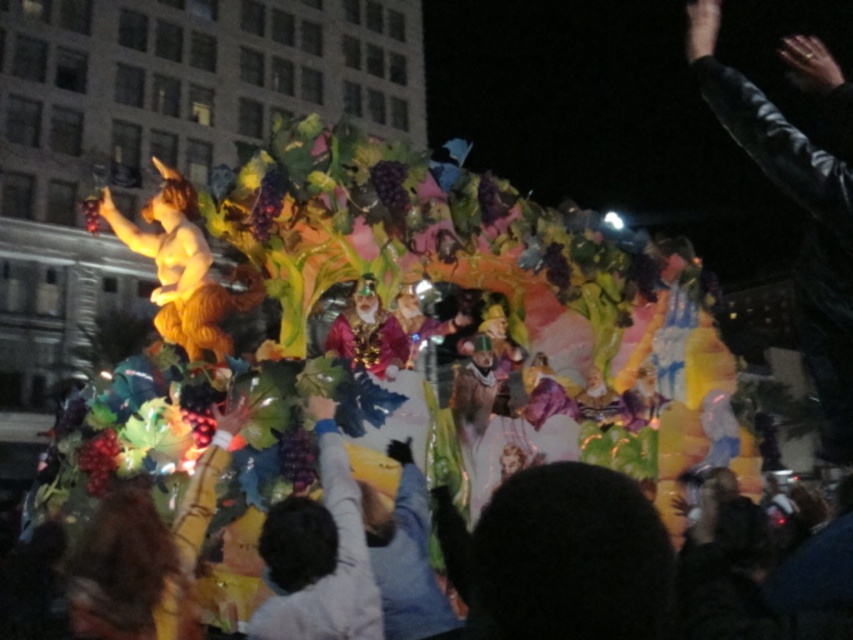
Question: Is black leather jacket at upper right positioned before smooth purple grapes at center?

Choices:
 (A) no
 (B) yes

Answer: (A)

Question: Which of the following is the farthest from the observer?

Choices:
 (A) black leather jacket at upper right
 (B) smooth purple grapes at center

Answer: (A)

Question: Can you confirm if black leather jacket at upper right is positioned above smooth purple grapes at center?

Choices:
 (A) no
 (B) yes

Answer: (B)

Question: Among these objects, which one is nearest to the camera?

Choices:
 (A) black leather jacket at upper right
 (B) smooth purple grapes at center

Answer: (B)

Question: Can you confirm if black leather jacket at upper right is positioned above smooth purple grapes at center?

Choices:
 (A) no
 (B) yes

Answer: (B)